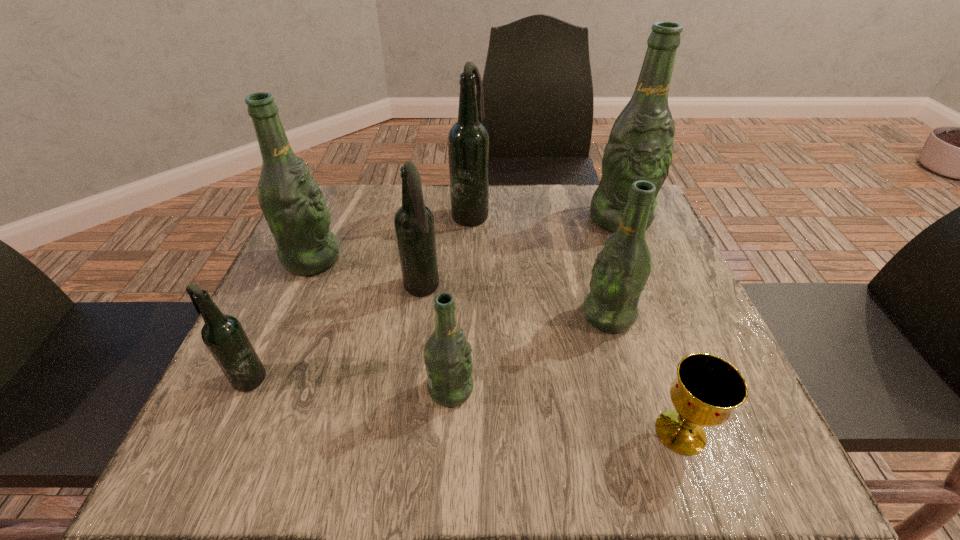
This screenshot has width=960, height=540. What are the coordinates of `the leftmost dark beer bottle` in the screenshot? It's located at (224, 336).

Locate an element on the screen. Image resolution: width=960 pixels, height=540 pixels. the nearest green beer bottle is located at coordinates (447, 354).

Where is `the third green beer bottle from right to left`? the third green beer bottle from right to left is located at coordinates (447, 354).

At what (x,y) coordinates should I click in order to perform the action: click on the shortest object. Please return your answer as a coordinate pair (x, y). Looking at the image, I should click on (707, 389).

Find the location of a particular element. gold chalice is located at coordinates (707, 389).

The height and width of the screenshot is (540, 960). Find the location of `vacant region located on the surface of the tallest beer bottle`. vacant region located on the surface of the tallest beer bottle is located at coordinates (651, 296).

At what (x,y) coordinates should I click in order to perform the action: click on vacant area located 0.300m on the left of the rightmost dark beer bottle. Please return your answer as a coordinate pair (x, y). Looking at the image, I should click on (337, 213).

Where is `free point located 0.340m on the surface of the second biggest green beer bottle`? This screenshot has height=540, width=960. free point located 0.340m on the surface of the second biggest green beer bottle is located at coordinates (489, 259).

Where is `vacant position located 0.190m on the surface of the second nearest green beer bottle`? This screenshot has height=540, width=960. vacant position located 0.190m on the surface of the second nearest green beer bottle is located at coordinates (488, 316).

This screenshot has width=960, height=540. I want to click on free space located on the surface of the second nearest green beer bottle, so click(x=453, y=316).